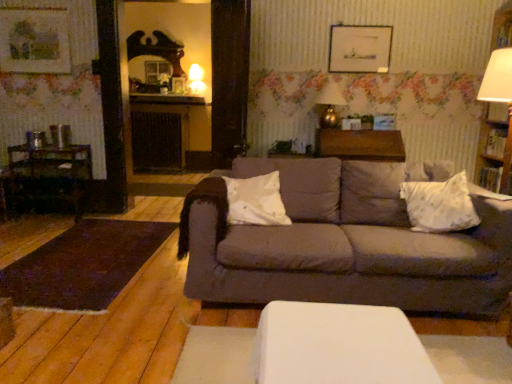
Find the location of a particular element. Image resolution: width=512 pixels, height=384 pixels. vacant region to the right of wooden dark chair at left is located at coordinates click(102, 221).